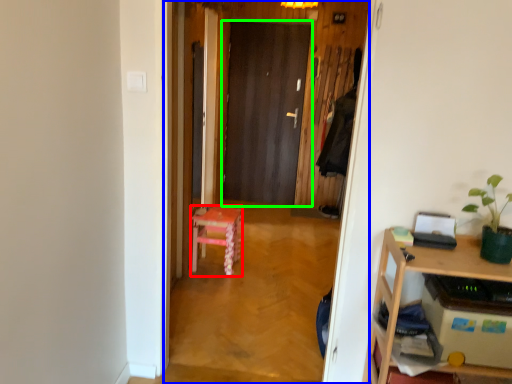
Question: Estimate the real-world distances between objects in this image. Which object is farther from stool (highlighted by a red box), corridor (highlighted by a blue box) or door (highlighted by a green box)?

Choices:
 (A) corridor
 (B) door

Answer: (B)